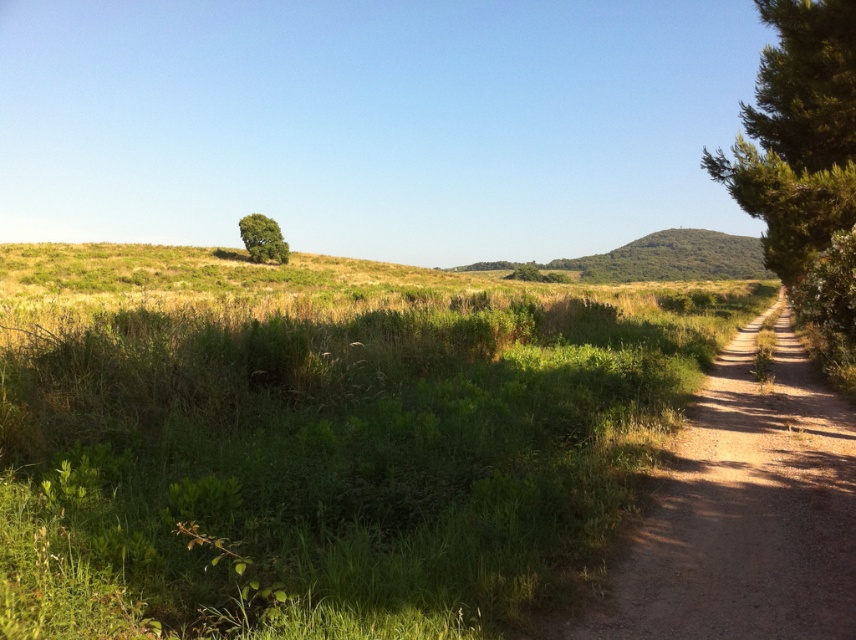
Question: Considering the real-world distances, which object is closest to the dirt/gravel path at center-right?

Choices:
 (A) green leafy tree at right
 (B) green leafy tree at upper left

Answer: (A)

Question: Among these objects, which one is nearest to the camera?

Choices:
 (A) dirt/gravel path at center-right
 (B) green leafy tree at right

Answer: (A)

Question: Can you confirm if dirt/gravel path at center-right is wider than green leafy tree at right?

Choices:
 (A) no
 (B) yes

Answer: (A)

Question: Does dirt/gravel path at center-right have a lesser width compared to green leafy tree at right?

Choices:
 (A) yes
 (B) no

Answer: (A)

Question: Which is farther from the green leafy tree at upper left?

Choices:
 (A) green leafy tree at right
 (B) dirt/gravel path at center-right

Answer: (B)

Question: Can you confirm if dirt/gravel path at center-right is bigger than green leafy tree at upper left?

Choices:
 (A) yes
 (B) no

Answer: (B)